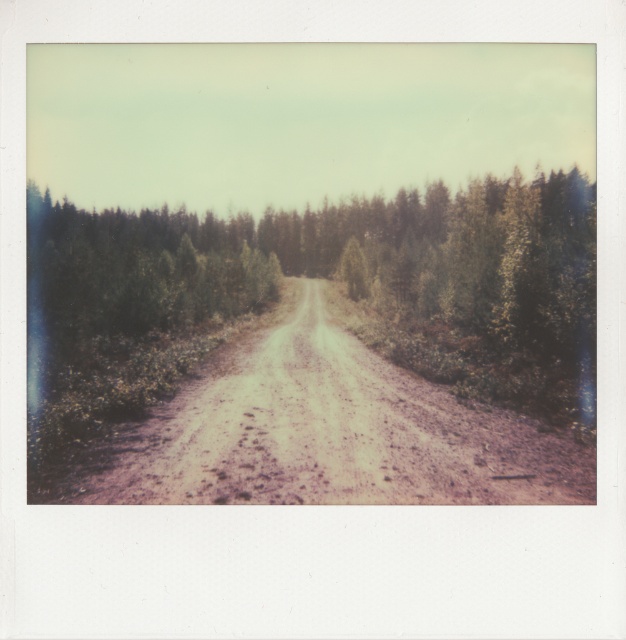
You are a hiker trying to locate the green textured forest at center in this rural scene. Based on the coordinates provided, where exactly would you find it?

The green textured forest at center is located at the coordinates point (329, 276).

You are driving a car that is 2 meters wide. You are on the dusty gravel road at center and want to turn left into a narrow path that is 2.5 meters wide. The green textured forest at center is blocking part of the road. Can your car safely make the turn without hitting the trees?

The green textured forest at center is positioned on the left side of dusty gravel road at center, so the forest is on the left side of the road. Since the narrow path is 2.5 meters wide and your car is 2 meters wide, there is enough space for the car to safely turn left without hitting the trees as long as the path is clear of other obstacles.

Looking at this image, you are driving a car on the dusty gravel road at center and want to avoid hitting the green textured forest at center. Is it possible to steer to the left or right to avoid it?

The green textured forest at center is positioned over the dusty gravel road at center, meaning the forest is above the road. Since the road is at the center, steering left or right would keep you on the road and away from the forest which is overhead, so yes, you can safely steer left or right to avoid it.